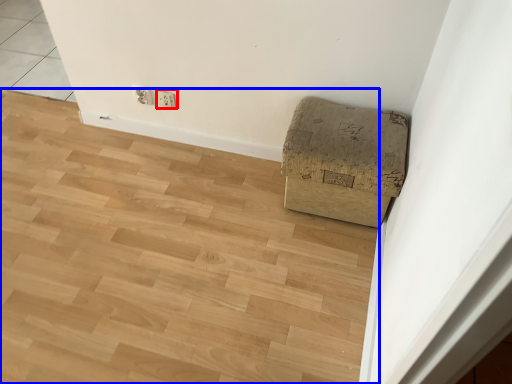
Question: Which object appears closest to the camera in this image, electric outlet (highlighted by a red box) or plywood (highlighted by a blue box)?

Choices:
 (A) electric outlet
 (B) plywood

Answer: (B)